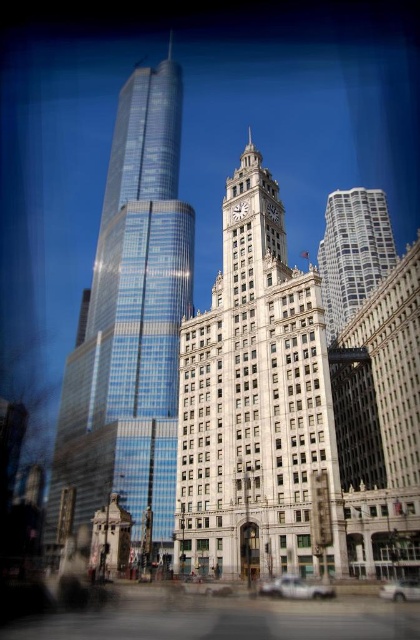
Question: Can you confirm if white stone clock tower at center is positioned above white matte car at lower right?

Choices:
 (A) yes
 (B) no

Answer: (A)

Question: Which object is the closest to the shiny glass skyscraper at left?

Choices:
 (A) white glass tower at center
 (B) white matte car at lower right
 (C) white stone clock tower at center

Answer: (C)

Question: In this image, where is white stone clock tower at center located relative to white glass tower at center?

Choices:
 (A) below
 (B) above

Answer: (B)

Question: Among these objects, which one is nearest to the camera?

Choices:
 (A) white glass tower at center
 (B) silver metallic car at lower center
 (C) shiny glass skyscraper at left

Answer: (B)

Question: Which point is closer to the camera taking this photo?

Choices:
 (A) (330, 396)
 (B) (322, 298)
 (C) (291, 592)

Answer: (C)

Question: Where is white glass tower at center located in relation to white matte car at lower right in the image?

Choices:
 (A) above
 (B) below

Answer: (A)